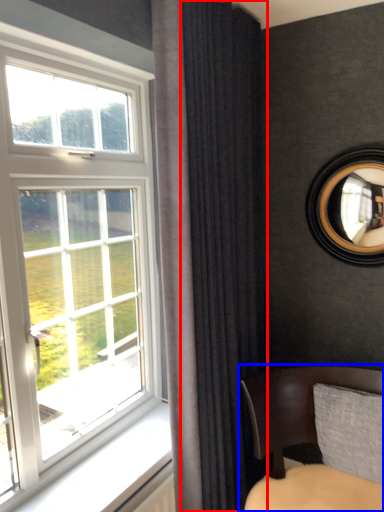
Question: Which of the following is the closest to the observer, curtain (highlighted by a red box) or chair (highlighted by a blue box)?

Choices:
 (A) curtain
 (B) chair

Answer: (B)